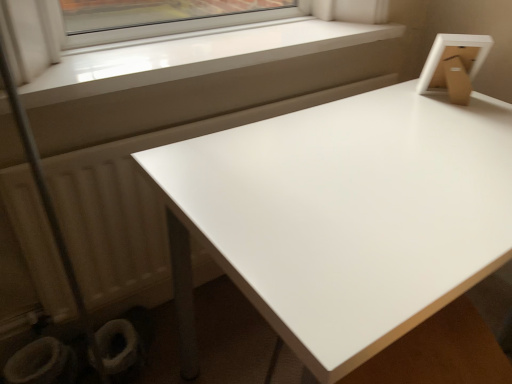
Where is `free space above white smooth window sill at upper left (from a real-world perspective)`? This screenshot has width=512, height=384. free space above white smooth window sill at upper left (from a real-world perspective) is located at coordinates (233, 42).